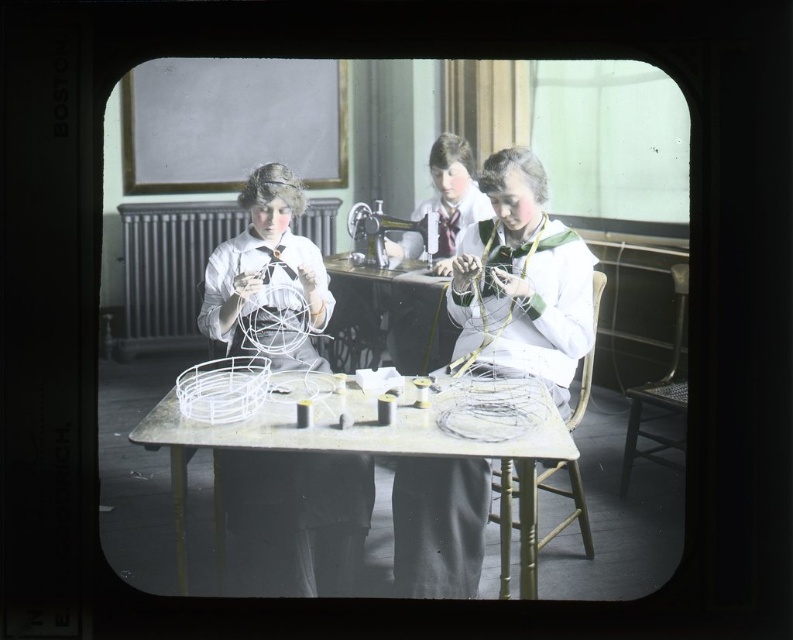
You are standing in front of the table in the vintage photograph. There are two points marked on the table surface. The first point is at coordinate [477,570] and the second is at [428,172]. Which of these two points is closer to you?

Point [477,570] is closer to the viewer than point [428,172].

You are standing in front of the table shown in the image. Where is the white wire basket at center located in terms of coordinates?

The white wire basket at center is located at coordinates point (361, 449).

You are an assistant who needs to locate the white matte wire basket at center in the image. What are the coordinates of its position?

The white matte wire basket at center is located at coordinates point (293, 520).